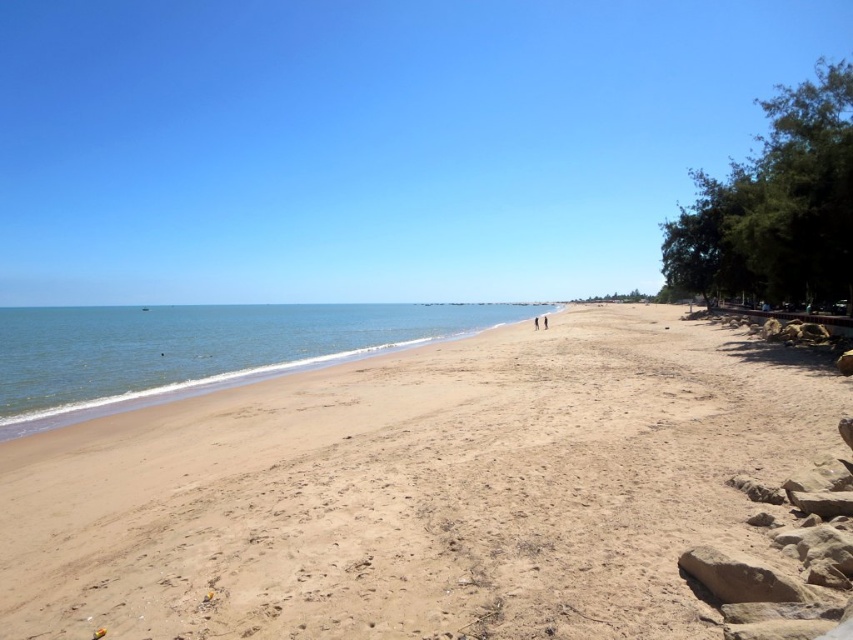
Question: Can you confirm if blue water at left is positioned above skinny jeans at center?

Choices:
 (A) yes
 (B) no

Answer: (A)

Question: Which of the following is the farthest from the observer?

Choices:
 (A) skinny jeans at center
 (B) light brown sand at center
 (C) blue water at left

Answer: (A)

Question: Which object appears closest to the camera in this image?

Choices:
 (A) light brown sand at center
 (B) blue water at left
 (C) skinny jeans at center

Answer: (A)

Question: Is light brown sand at center thinner than blue water at left?

Choices:
 (A) yes
 (B) no

Answer: (A)

Question: Based on their relative distances, which object is nearer to the skinny person at center?

Choices:
 (A) blue water at left
 (B) light brown sand at center
 (C) skinny jeans at center

Answer: (C)

Question: Can you confirm if light brown sand at center is thinner than skinny jeans at center?

Choices:
 (A) no
 (B) yes

Answer: (A)